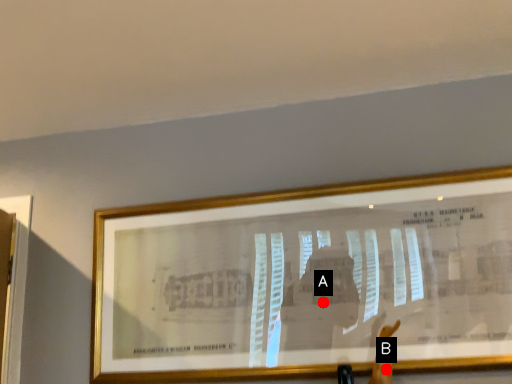
Question: Two points are circled on the image, labeled by A and B beside each circle. Which of the following is the farthest from the observer?

Choices:
 (A) A is further
 (B) B is further

Answer: (A)